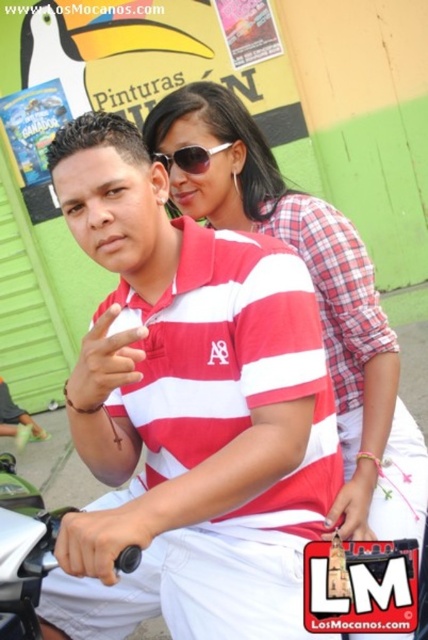
Question: Can you confirm if white striped polo shirt at center is positioned below sunglasses at center?

Choices:
 (A) yes
 (B) no

Answer: (A)

Question: Among these points, which one is nearest to the camera?

Choices:
 (A) (262, 209)
 (B) (175, 461)
 (C) (23, 545)

Answer: (C)

Question: Observing the image, what is the correct spatial positioning of matte red shirt at center in reference to sunglasses at center?

Choices:
 (A) below
 (B) above

Answer: (A)

Question: Among these objects, which one is farthest from the camera?

Choices:
 (A) matte red shirt at center
 (B) white plastic handlebar at lower left
 (C) sunglasses at center

Answer: (C)

Question: Considering the relative positions of matte red shirt at center and white plastic handlebar at lower left in the image provided, where is matte red shirt at center located with respect to white plastic handlebar at lower left?

Choices:
 (A) right
 (B) left

Answer: (A)

Question: Among these points, which one is nearest to the camera?

Choices:
 (A) (26, 616)
 (B) (104, 440)
 (C) (208, 161)
 (D) (190, 145)

Answer: (A)